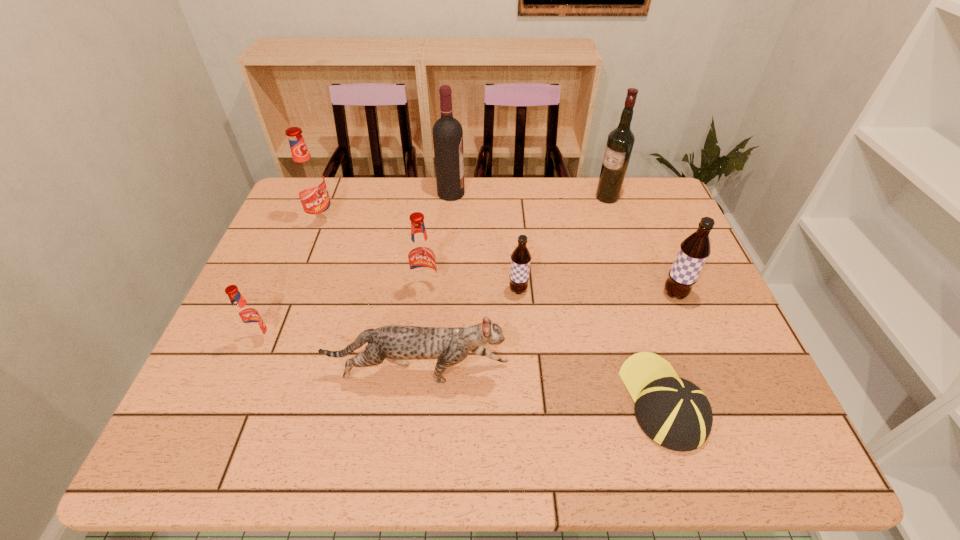
Locate an element on the screen. wine bottle that is at the right edge is located at coordinates (620, 141).

At what (x,y) coordinates should I click in order to perform the action: click on root beer positioned at the right edge. Please return your answer as a coordinate pair (x, y). The width and height of the screenshot is (960, 540). Looking at the image, I should click on (694, 250).

In order to click on baseball cap present at the right edge in this screenshot , I will do `click(673, 412)`.

The height and width of the screenshot is (540, 960). Identify the location of object present at the far left corner. (308, 179).

Identify the location of object positioned at the far right corner. (620, 141).

You are a GUI agent. You are given a task and a screenshot of the screen. Output one action in this format:
    pyautogui.click(x=<x>, y=<y>)
    Task: Click on the object located at the near right corner
    The image size is (960, 540).
    Given the screenshot: What is the action you would take?
    pyautogui.click(x=673, y=412)

Image resolution: width=960 pixels, height=540 pixels. I want to click on vacant space at the far edge, so click(365, 210).

The height and width of the screenshot is (540, 960). I want to click on vacant point at the near edge, so click(x=485, y=436).

You are a GUI agent. You are given a task and a screenshot of the screen. Output one action in this format:
    pyautogui.click(x=<x>, y=<y>)
    Task: Click on the vacant point at the left edge
    This screenshot has width=960, height=540.
    Given the screenshot: What is the action you would take?
    pyautogui.click(x=282, y=319)

Where is `vacant space at the right edge of the desktop`? The height and width of the screenshot is (540, 960). vacant space at the right edge of the desktop is located at coordinates (712, 301).